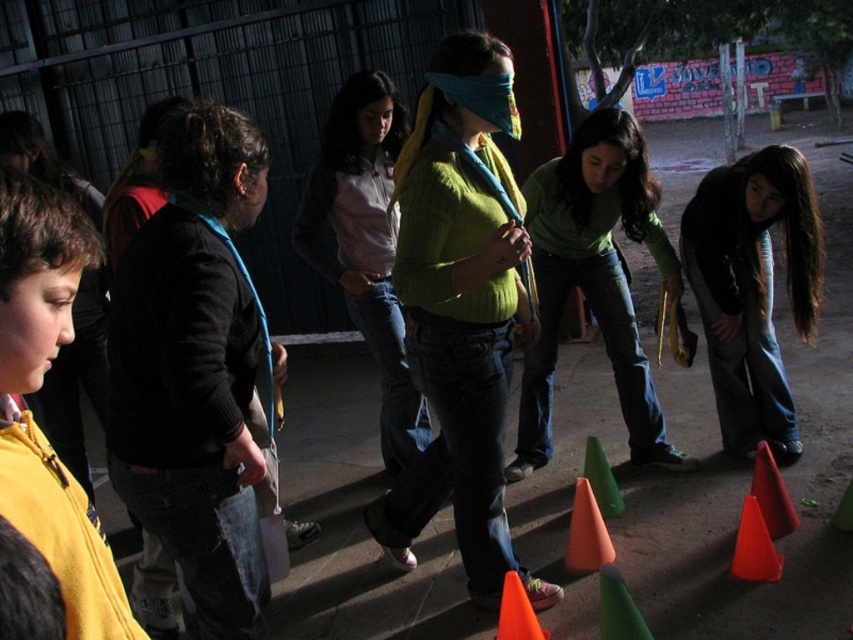
Is green matte sweater at center to the right of orange matte traffic cone at lower center from the viewer's perspective?

Yes, green matte sweater at center is to the right of orange matte traffic cone at lower center.

Does green matte sweater at center have a greater width compared to orange matte traffic cone at lower center?

Indeed, green matte sweater at center has a greater width compared to orange matte traffic cone at lower center.

The image size is (853, 640). Find the location of `green matte sweater at center`. green matte sweater at center is located at coordinates (595, 280).

Which of these two, orange matte traffic cone at lower center or orange plastic cone at lower right, stands taller?

orange matte traffic cone at lower center

Does point (592, 564) come farther from viewer compared to point (763, 470)?

No.

Identify the location of orange matte traffic cone at lower center. (585, 532).

Between orange matte traffic cone at lower center and green matte traffic cone at lower center, which one is positioned higher?

orange matte traffic cone at lower center is above.

Who is positioned more to the right, orange matte traffic cone at lower center or green matte traffic cone at lower center?

Positioned to the right is orange matte traffic cone at lower center.

Is point (593, 545) positioned after point (608, 589)?

Yes, it is behind point (608, 589).

This screenshot has height=640, width=853. What are the coordinates of `orange matte traffic cone at lower center` in the screenshot? It's located at (585, 532).